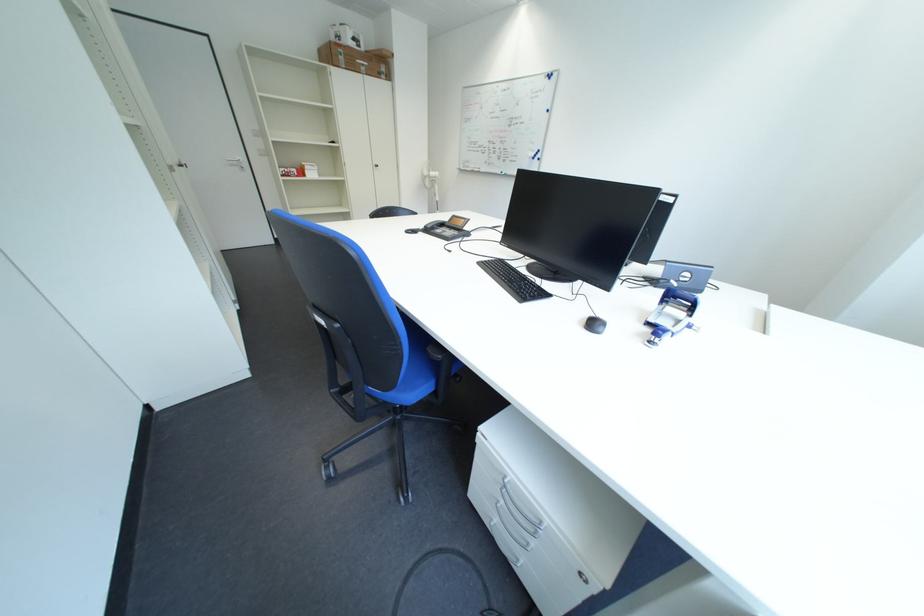
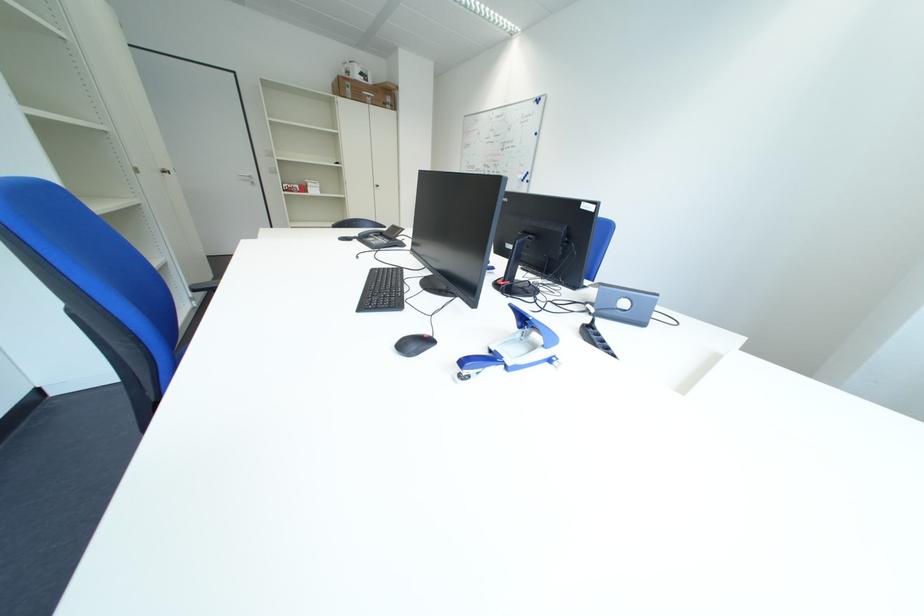
Question: The first image is from the beginning of the video and the second image is from the end. How did the camera likely rotate when shooting the video?

Choices:
 (A) Left
 (B) Right
 (C) Up
 (D) Down

Answer: (A)